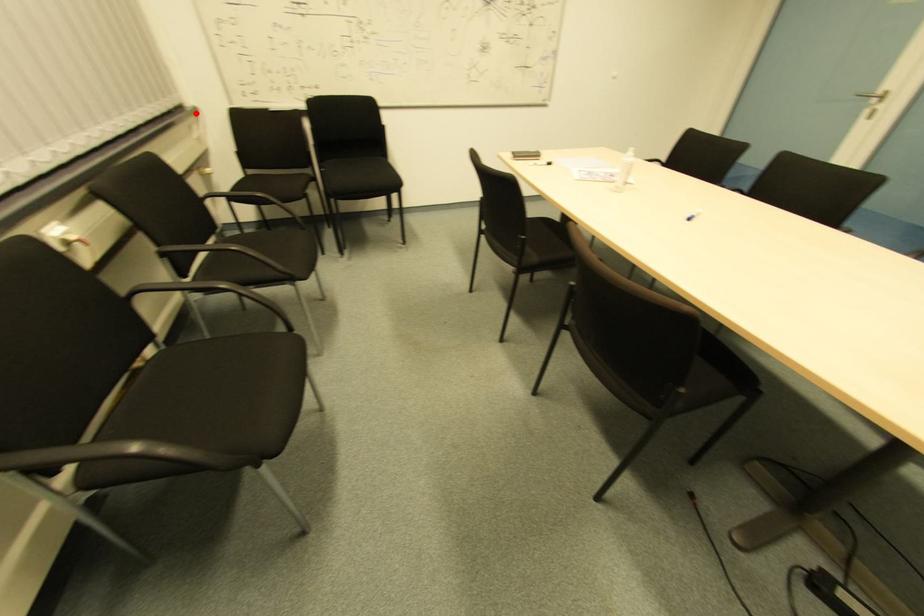
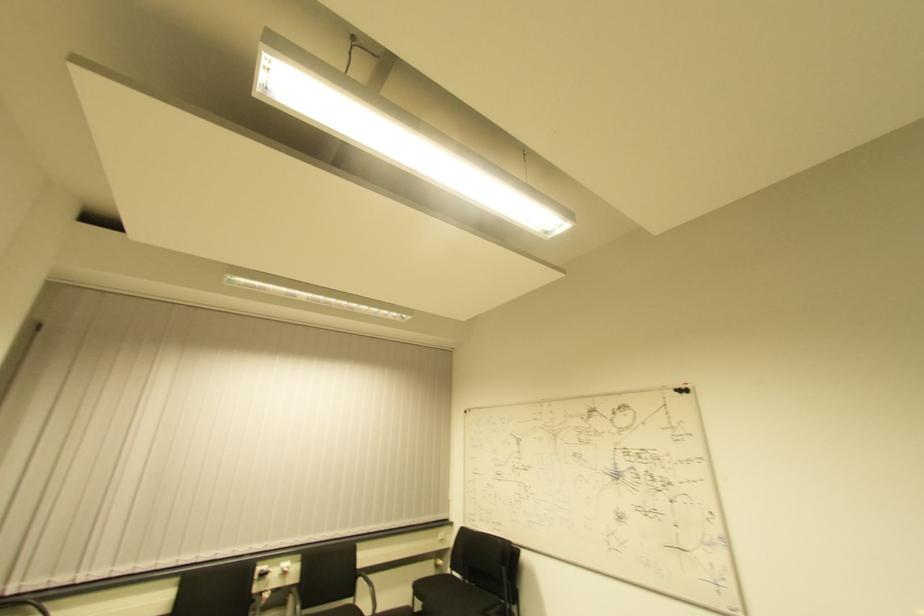
Question: I am providing you with two images of the same scene from different viewpoints. Image1 has a red point marked. In image2, the corresponding 3D location appears at what relative position? Reply with the corresponding letter.

Choices:
 (A) Closer
 (B) Farther

Answer: (B)